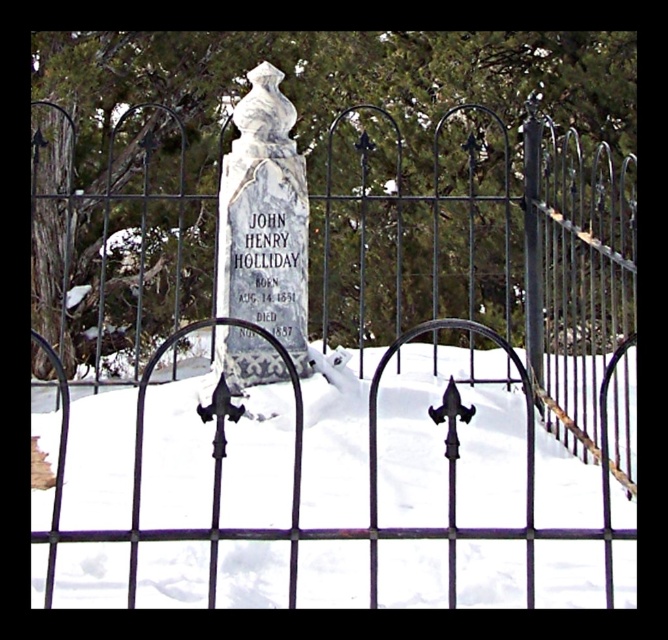
You are a visitor at the cemetery and want to place a bouquet of flowers between the black wrought iron gate at center and the white marble gravestone at center. Which object should you place the flowers closer to if you want them to be near the smaller object?

The white marble gravestone at center is smaller than the black wrought iron gate at center, so you should place the flowers closer to the white marble gravestone at center.

You are standing at the point marked by the coordinate point (301,477). Looking towards the gravestone, can you see the decorative finial on top of the gravestone clearly?

Yes, the point marked by coordinate point (301,477) is the black wrought iron gate at center, which is in front of the gravestone. Since the gate is at the center and the gravestone is behind it, the decorative finial on top of the gravestone should be visible from this position as there is no obstruction mentioned between them.

You are a visitor at the cemetery and want to walk through the black wrought iron gate at center to reach the white marble gravestone at center. Can you pass through the gate without touching its sides?

The black wrought iron gate at center is wider than the white marble gravestone at center, so yes, you can pass through the gate without touching its sides as the gate is wider than the gravestone.